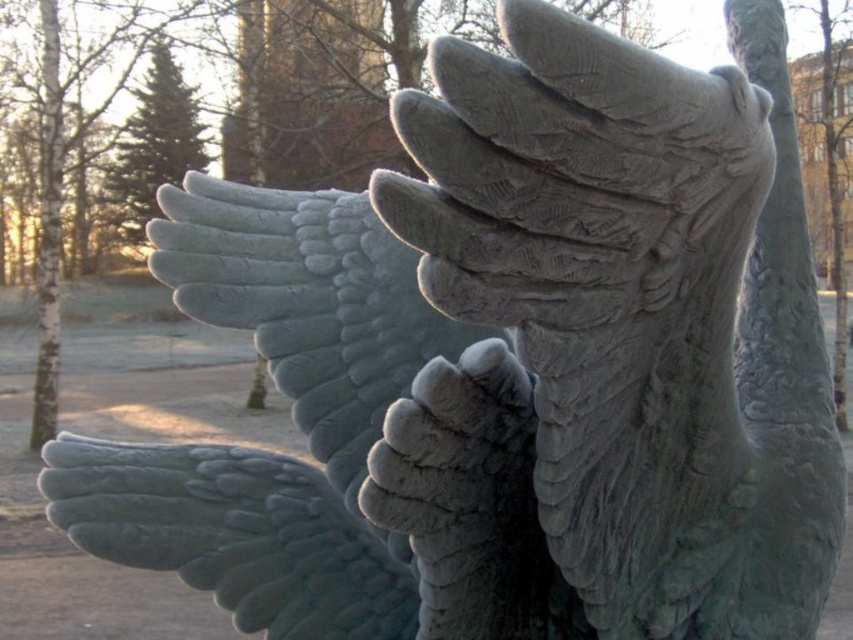
Is bronze textured hand at upper center closer to camera compared to green stone wing at lower left?

Yes, it is in front of green stone wing at lower left.

Looking at this image, is bronze textured hand at upper center taller than green stone wing at lower left?

Yes, bronze textured hand at upper center is taller than green stone wing at lower left.

From the picture: Who is more forward, [529,234] or [91,544]?

Point [529,234] is more forward.

The image size is (853, 640). I want to click on bronze textured hand at upper center, so click(x=579, y=189).